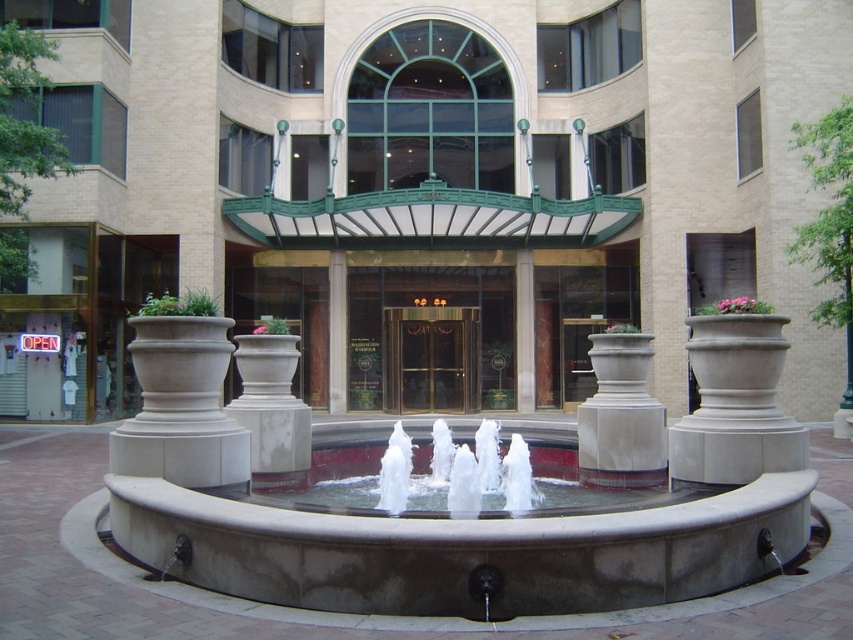
You are standing in the middle of the architectural setting and want to walk towards the white concrete planter at center. Which direction should you move relative to the smooth concrete fountain at center?

You should move away from the smooth concrete fountain at center because the white concrete planter at center is further away from you than the fountain.

You are standing at the entrance of the building and want to walk to the smooth concrete fountain at center. There is a white concrete planter at center in between. Can you walk directly to the fountain without going around the planter?

The smooth concrete fountain at center is 16.82 meters away from the white concrete planter at center. Since the distance between them is significant, you can walk directly to the fountain without needing to go around the planter.